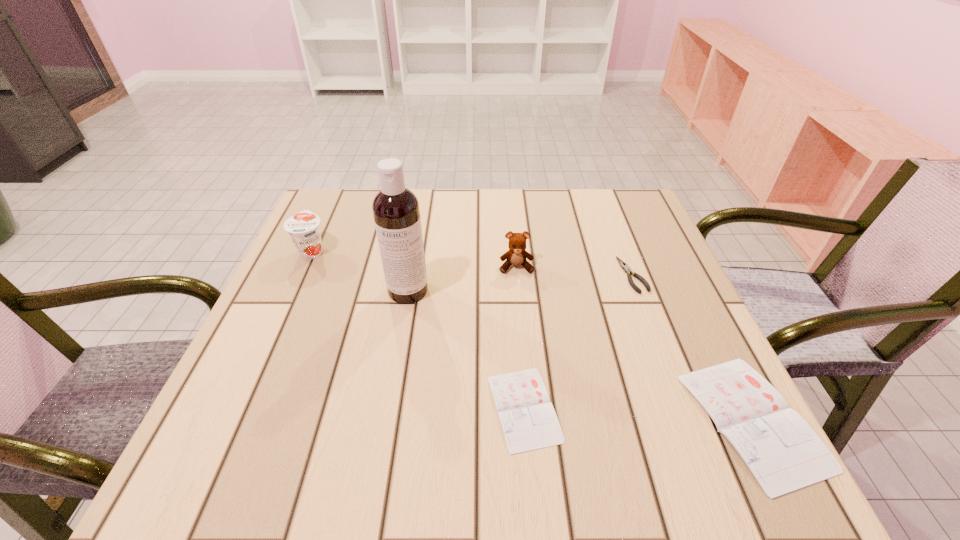
Identify the location of object positioned at the near right corner. (783, 452).

This screenshot has height=540, width=960. In order to click on vacant space at the far edge of the desktop in this screenshot , I will do `click(568, 188)`.

In order to click on vacant area at the near edge in this screenshot , I will do `click(322, 387)`.

You are a GUI agent. You are given a task and a screenshot of the screen. Output one action in this format:
    pyautogui.click(x=<x>, y=<y>)
    Task: Click on the free space at the left edge of the desktop
    Image resolution: width=960 pixels, height=540 pixels.
    Given the screenshot: What is the action you would take?
    pyautogui.click(x=293, y=279)

Where is `vacant space at the right edge`? This screenshot has width=960, height=540. vacant space at the right edge is located at coordinates (606, 266).

Where is `free region at the far left corner of the desktop`? Image resolution: width=960 pixels, height=540 pixels. free region at the far left corner of the desktop is located at coordinates click(x=351, y=233).

The width and height of the screenshot is (960, 540). I want to click on vacant space at the near left corner of the desktop, so click(270, 393).

Identify the location of free point at the far right corner. This screenshot has height=540, width=960. (632, 219).

Identify the location of free point between the teddy bear and the shorter diary. (520, 338).

The image size is (960, 540). I want to click on vacant region between the teddy bear and the shorter diary, so click(520, 338).